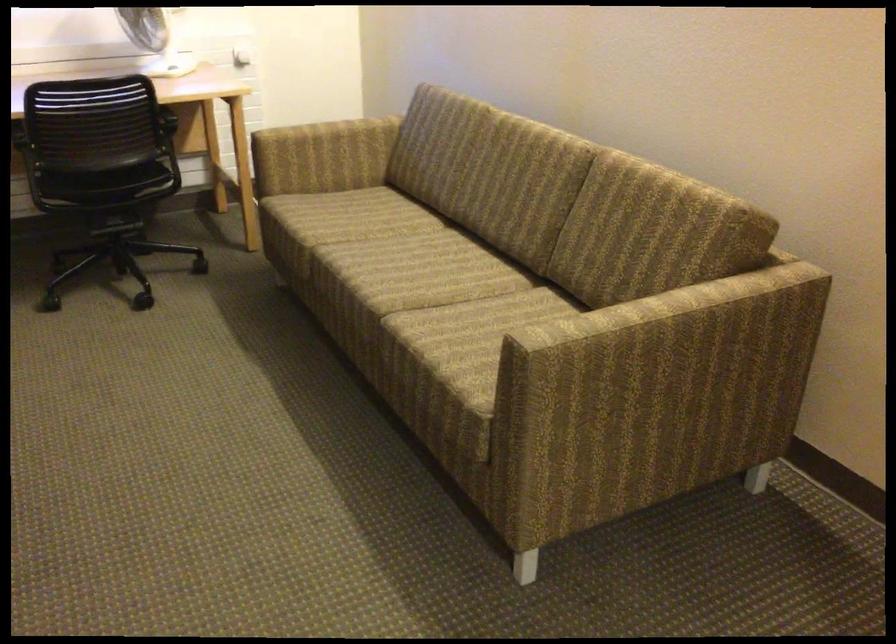
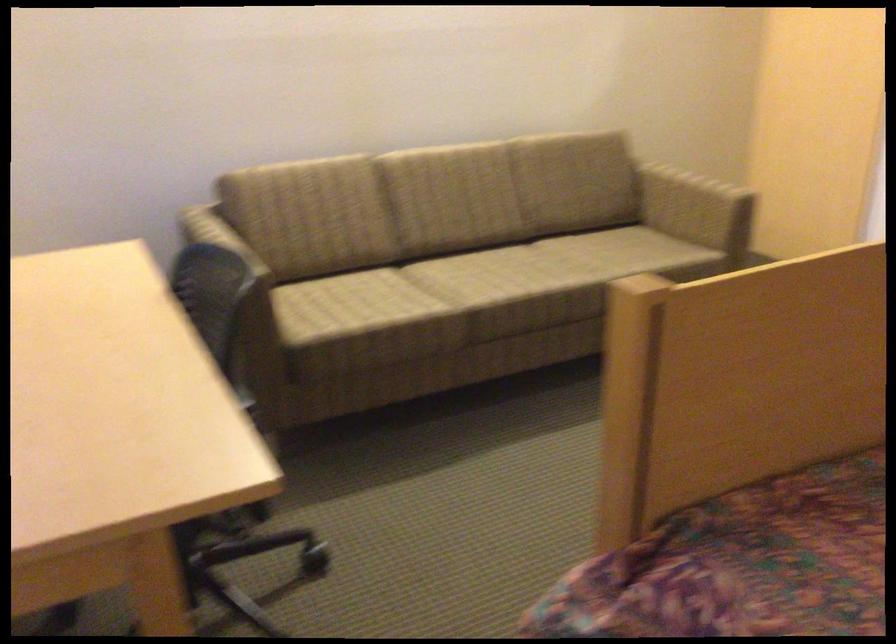
Where in the second image is the point corresponding to [563,346] from the first image?

(694, 207)